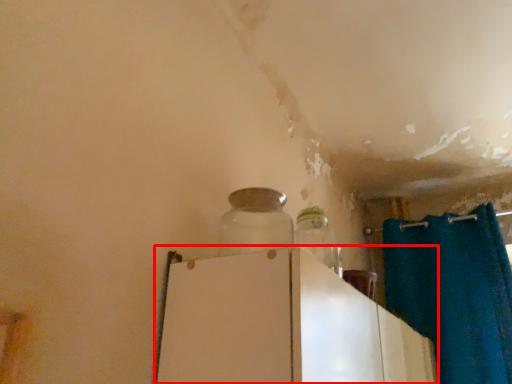
Question: From the image's perspective, what is the correct spatial relationship of appliance (annotated by the red box) in relation to bottle?

Choices:
 (A) above
 (B) below

Answer: (B)